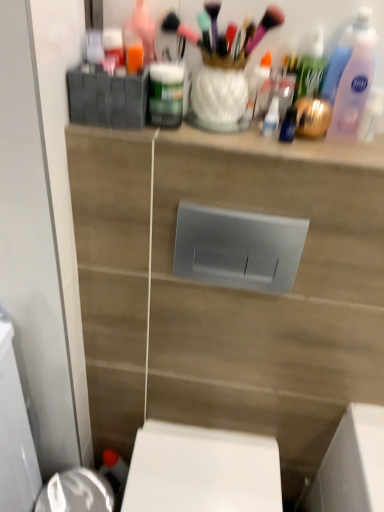
Locate an element on the screen. matte green jar at upper center is located at coordinates (166, 94).

The width and height of the screenshot is (384, 512). Describe the element at coordinates (351, 75) in the screenshot. I see `pink plastic bottle at upper right` at that location.

Identify the location of matte plastic toiletries at upper center. (255, 145).

The height and width of the screenshot is (512, 384). What are the coordinates of `ledge on the left of pink plastic bottle at upper right` in the screenshot? It's located at (255, 145).

From the image's perspective, which is below, pink plastic bottle at upper right or matte plastic toiletries at upper center?

matte plastic toiletries at upper center appears lower in the image.

Which object is positioned more to the left, pink plastic bottle at upper right or matte plastic toiletries at upper center?

From the viewer's perspective, matte plastic toiletries at upper center appears more on the left side.

Between pink plastic bottle at upper right and matte plastic toiletries at upper center, which one has more height?

pink plastic bottle at upper right is taller.

Does point (356, 108) come farther from viewer compared to point (168, 86)?

That is True.

From the image's perspective, is pink plastic bottle at upper right located above or below matte green jar at upper center?

From the image's perspective, pink plastic bottle at upper right appears above matte green jar at upper center.

Is pink plastic bottle at upper right to the right of matte green jar at upper center from the viewer's perspective?

Indeed, pink plastic bottle at upper right is positioned on the right side of matte green jar at upper center.

Considering the relative sizes of pink plastic bottle at upper right and matte green jar at upper center in the image provided, is pink plastic bottle at upper right bigger than matte green jar at upper center?

Yes, pink plastic bottle at upper right is bigger than matte green jar at upper center.

Considering the sizes of objects matte green jar at upper center and pink plastic bottle at upper right in the image provided, who is taller, matte green jar at upper center or pink plastic bottle at upper right?

Standing taller between the two is pink plastic bottle at upper right.

Measure the distance from matte green jar at upper center to pink plastic bottle at upper right.

matte green jar at upper center and pink plastic bottle at upper right are 12.27 inches apart from each other.

Is matte green jar at upper center beside pink plastic bottle at upper right?

matte green jar at upper center and pink plastic bottle at upper right are not in contact.

Is matte green jar at upper center inside or outside of pink plastic bottle at upper right?

matte green jar at upper center lies outside pink plastic bottle at upper right.

From the image's perspective, between matte plastic toiletries at upper center and pink plastic bottle at upper right, who is located below?

matte plastic toiletries at upper center.

Considering the positions of objects matte plastic toiletries at upper center and pink plastic bottle at upper right in the image provided, who is in front, matte plastic toiletries at upper center or pink plastic bottle at upper right?

pink plastic bottle at upper right is more forward.

Is matte plastic toiletries at upper center inside the boundaries of pink plastic bottle at upper right, or outside?

matte plastic toiletries at upper center is not enclosed by pink plastic bottle at upper right.

Is matte green jar at upper center inside or outside of matte plastic toiletries at upper center?

matte green jar at upper center exists outside the volume of matte plastic toiletries at upper center.

Considering the sizes of objects matte green jar at upper center and matte plastic toiletries at upper center in the image provided, who is wider, matte green jar at upper center or matte plastic toiletries at upper center?

matte plastic toiletries at upper center.

Is matte green jar at upper center bigger than matte plastic toiletries at upper center?

No.

Is matte plastic toiletries at upper center facing away from matte green jar at upper center?

No, matte plastic toiletries at upper center's orientation is not away from matte green jar at upper center.

How many degrees apart are the facing directions of matte plastic toiletries at upper center and matte green jar at upper center?

0.0135 degrees.

Are matte plastic toiletries at upper center and matte green jar at upper center far apart?

No, there isn't a large distance between matte plastic toiletries at upper center and matte green jar at upper center.

Can matte green jar at upper center be found inside matte plastic toiletries at upper center?

No, matte plastic toiletries at upper center does not contain matte green jar at upper center.

The height and width of the screenshot is (512, 384). Identify the location of cleaning product located above the matte plastic toiletries at upper center (from a real-world perspective). (351, 75).

The height and width of the screenshot is (512, 384). Identify the location of toiletry below the pink plastic bottle at upper right (from a real-world perspective). (166, 94).

Which object lies further to the anchor point matte green jar at upper center, matte plastic toiletries at upper center or pink plastic bottle at upper right?

pink plastic bottle at upper right.

Estimate the real-world distances between objects in this image. Which object is further from pink plastic bottle at upper right, matte green jar at upper center or matte plastic toiletries at upper center?

Among the two, matte green jar at upper center is located further to pink plastic bottle at upper right.

From the image, which object appears to be farther from matte plastic toiletries at upper center, matte green jar at upper center or pink plastic bottle at upper right?

pink plastic bottle at upper right is further to matte plastic toiletries at upper center.

Estimate the real-world distances between objects in this image. Which object is further from pink plastic bottle at upper right, matte plastic toiletries at upper center or matte green jar at upper center?

matte green jar at upper center is positioned further to the anchor pink plastic bottle at upper right.

Considering their positions, is pink plastic bottle at upper right positioned further to matte plastic toiletries at upper center than matte green jar at upper center?

pink plastic bottle at upper right.

Which object lies further to the anchor point matte green jar at upper center, pink plastic bottle at upper right or matte plastic toiletries at upper center?

pink plastic bottle at upper right lies further to matte green jar at upper center than the other object.

You are a GUI agent. You are given a task and a screenshot of the screen. Output one action in this format:
    pyautogui.click(x=<x>, y=<y>)
    Task: Click on the ledge between matte green jar at upper center and pink plastic bottle at upper right in the horizontal direction
    This screenshot has width=384, height=512.
    Given the screenshot: What is the action you would take?
    pyautogui.click(x=255, y=145)